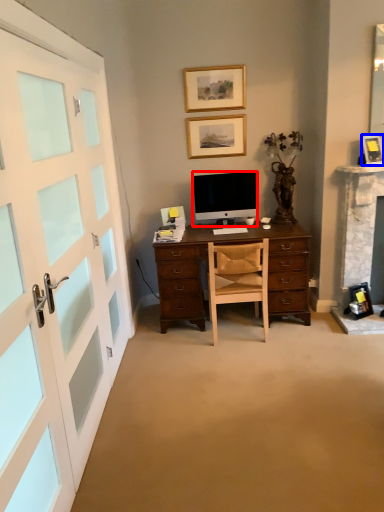
Question: Which object appears farthest to the camera in this image, television (highlighted by a red box) or picture frame (highlighted by a blue box)?

Choices:
 (A) television
 (B) picture frame

Answer: (A)